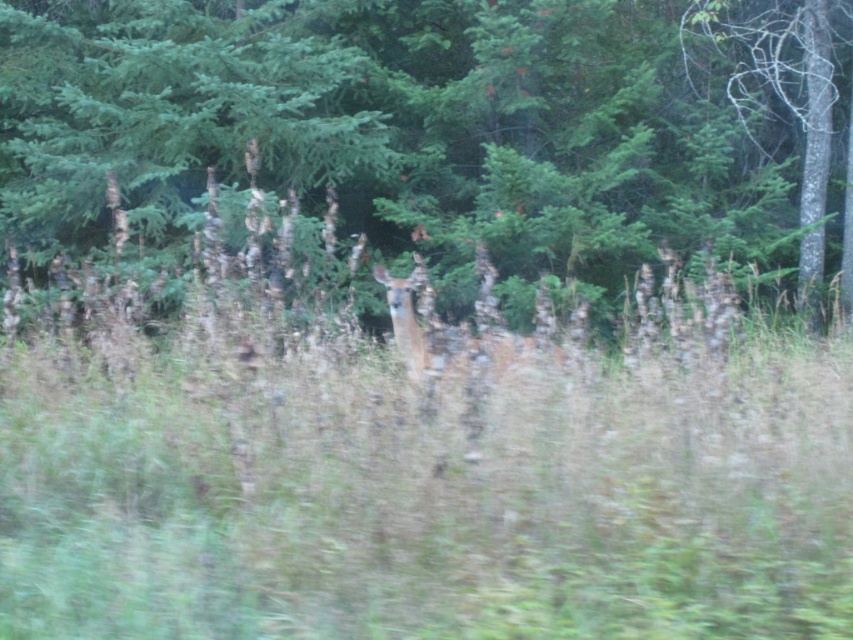
You are standing in the outdoor scene and see the green grass at center and the green matte tree at center. Which object is positioned to the right of the other?

The green grass at center is to the right of the green matte tree at center.

You are a gardener trying to plant a new sapling. You have a small shovel that can only dig up to 10 centimeters wide. You need to choose between the green grass at center and the green matte tree at center. Which area is suitable for digging with your shovel?

The green grass at center might be wider than the green matte tree at center, so it is more suitable for digging with the shovel since it can accommodate the 10 centimeter width.